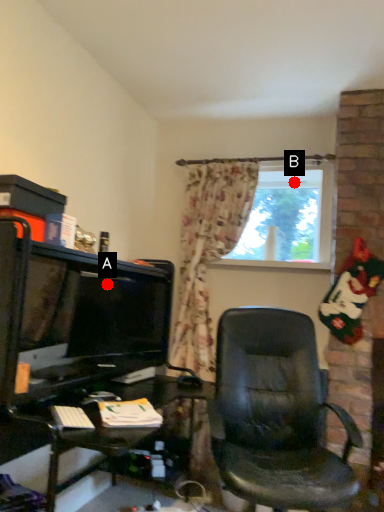
Question: Two points are circled on the image, labeled by A and B beside each circle. Among these points, which one is nearest to the camera?

Choices:
 (A) A is closer
 (B) B is closer

Answer: (A)